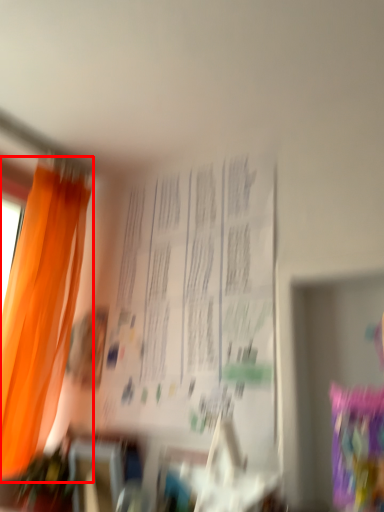
Question: Considering the relative positions of curtain (annotated by the red box) and bulletin board in the image provided, where is curtain (annotated by the red box) located with respect to the staircase?

Choices:
 (A) left
 (B) right

Answer: (A)